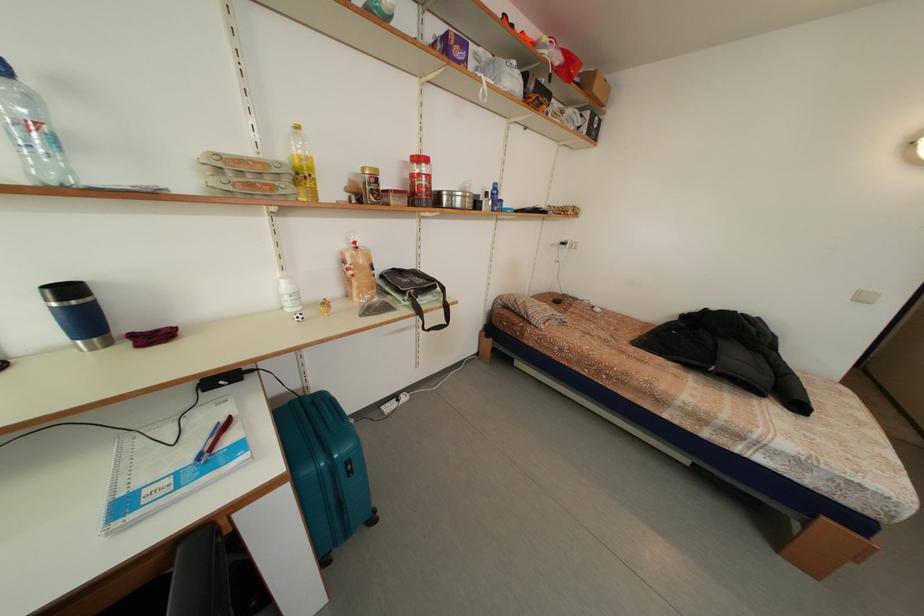
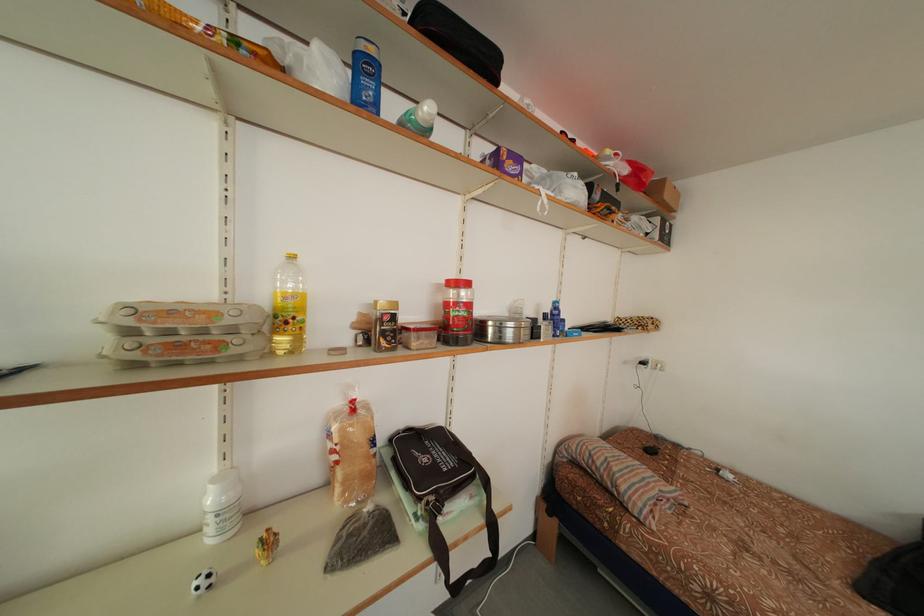
Find the pixel in the second image that matches point (453, 204) in the first image.

(499, 334)